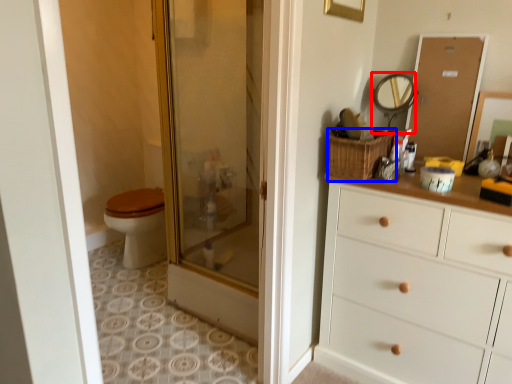
Question: Which object is closer to the camera taking this photo, mirror (highlighted by a red box) or basket (highlighted by a blue box)?

Choices:
 (A) mirror
 (B) basket

Answer: (B)